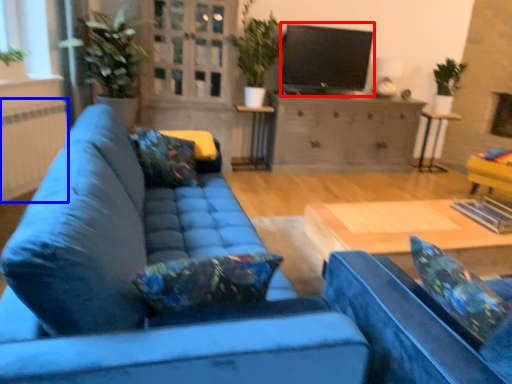
Question: Which object is further to the camera taking this photo, open (highlighted by a red box) or radiator (highlighted by a blue box)?

Choices:
 (A) open
 (B) radiator

Answer: (A)